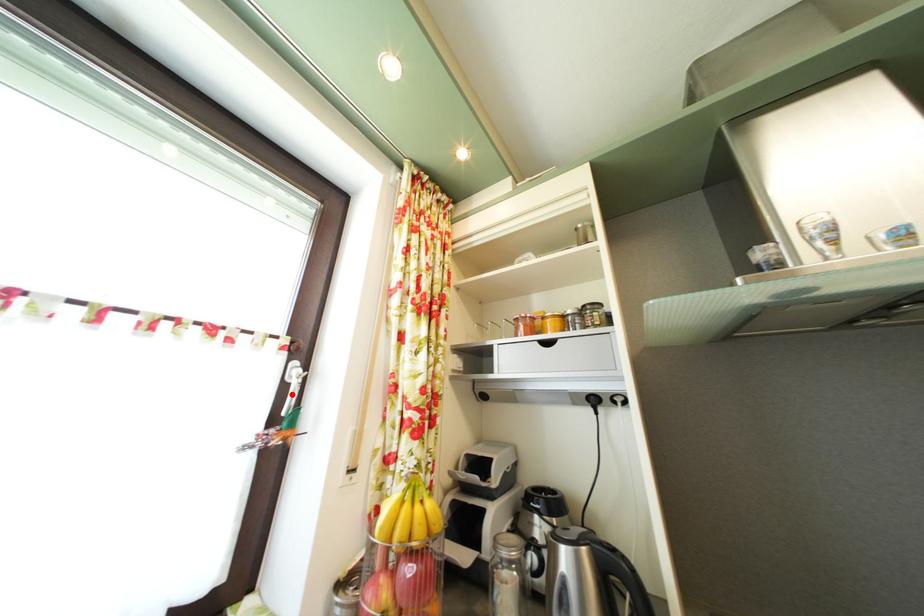
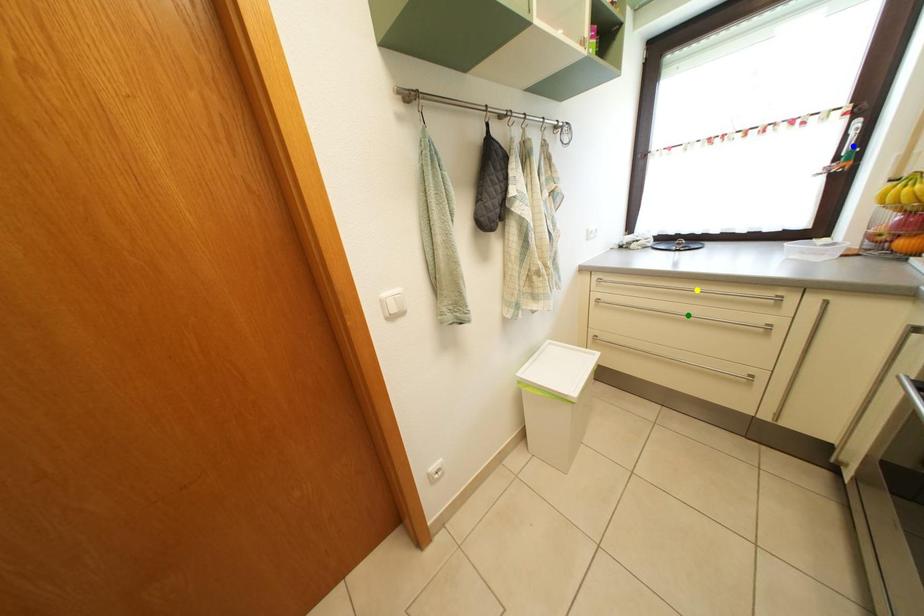
Question: I am providing you with two images of the same scene from different viewpoints. A red point is marked on the first image. You are given multiple points on the second image. In image 2, which mark is for the same physical point as the one in image 1?

Choices:
 (A) blue point
 (B) yellow point
 (C) green point

Answer: (A)